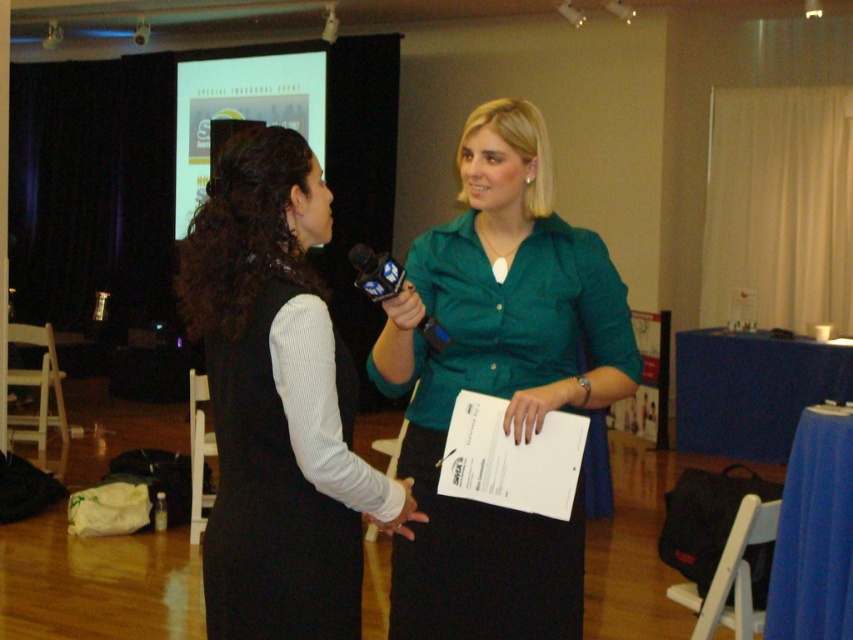
You are standing in the audience facing the stage. The woman on the left is holding a microphone with a blue logo. Where is the green matte shirt at center located relative to the woman on the left?

The green matte shirt at center is located to the right of the woman on the left since its 2D coordinates are at point (498, 384), which places it to the right side relative to the woman on the left.

Consider the image. You are a stagehand preparing to place a prop on the stage. The prop must be placed exactly where the black ribbed fabric dress at center is located. What are the coordinates where you should place the prop?

The coordinates for the black ribbed fabric dress at center are at point (x=270, y=506). You should place the prop at those coordinates.

Looking at this image, you are a stagehand setting up for an event. You need to place a new microphone stand to the left of the green matte shirt at center. Where should you position it relative to the black plastic microphone at center?

The green matte shirt at center is on the right side of the black plastic microphone at center. To place the new microphone stand to the left of the green matte shirt at center, position it between the black plastic microphone at center and the green matte shirt at center.